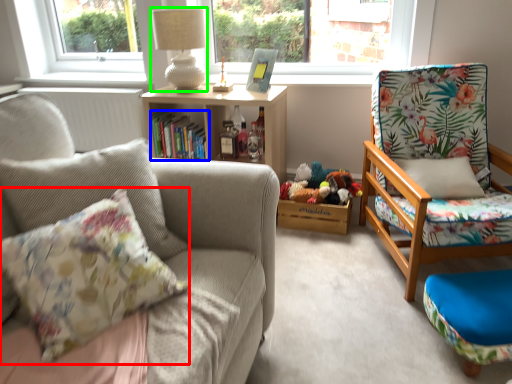
Question: Estimate the real-world distances between objects in this image. Which object is farther from pillow (highlighted by a red box), book (highlighted by a blue box) or lamp (highlighted by a green box)?

Choices:
 (A) book
 (B) lamp

Answer: (B)